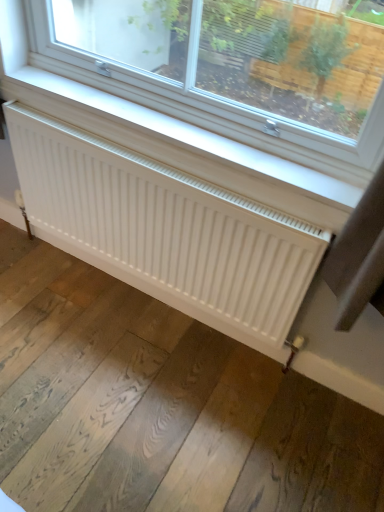
This screenshot has height=512, width=384. I want to click on vacant area in front of white matte radiator at lower center, so click(x=125, y=387).